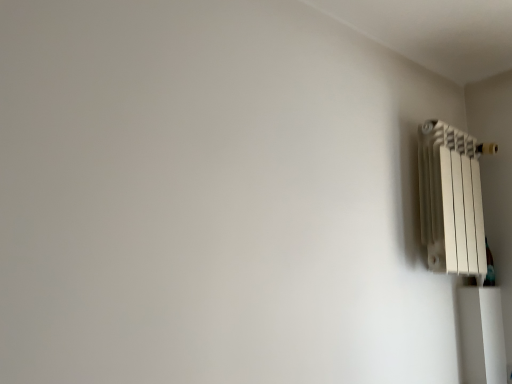
Measure the distance between white matte radiator at upper right and camera.

white matte radiator at upper right and camera are 5.12 feet apart from each other.

Where is `white matte radiator at upper right`? The height and width of the screenshot is (384, 512). white matte radiator at upper right is located at coordinates (452, 201).

The width and height of the screenshot is (512, 384). What do you see at coordinates (452, 201) in the screenshot?
I see `white matte radiator at upper right` at bounding box center [452, 201].

The image size is (512, 384). In order to click on white matte radiator at upper right in this screenshot , I will do 452,201.